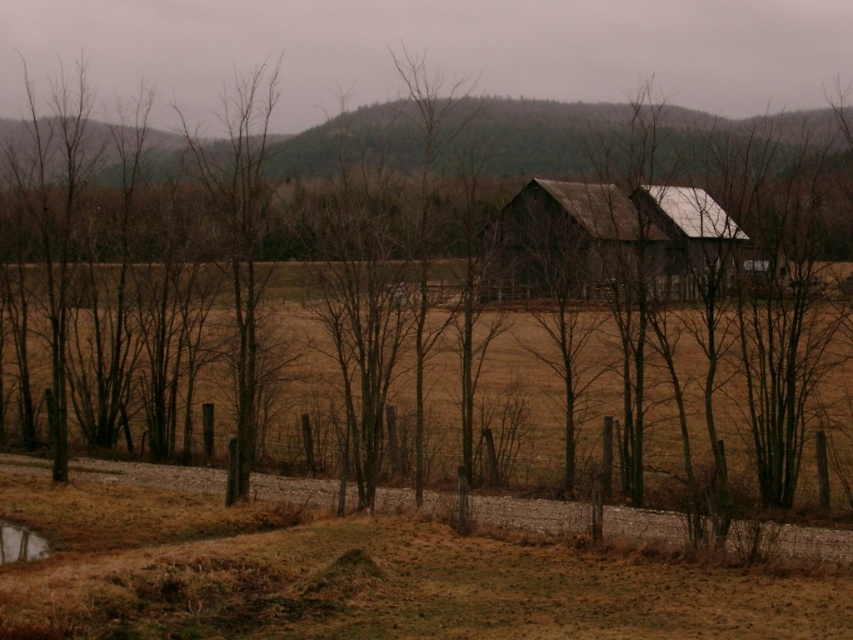
You are standing at the origin point in the image and want to locate the rusty metal barn at center. According to the coordinates provided, in which direction should you move to reach it?

The rusty metal barn at center is located at coordinates point [608,241]. Since the origin is at the bottom left corner, moving towards the right and upwards will lead you to the barn.

You are a farmer who needs to cross from the reflective wet surface at lower left to the rusty metal barn at center. Can you walk directly between them without any obstacles?

The distance between the rusty metal barn at center and the reflective wet surface at lower left is 13.02 meters. Since there are no obstacles mentioned in the scene description, you can walk directly between them.